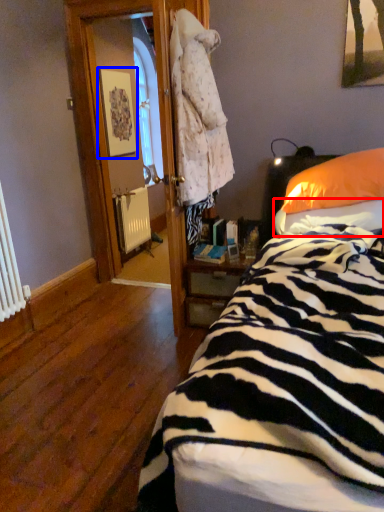
Question: Which object appears closest to the camera in this image, sheet (highlighted by a red box) or picture frame (highlighted by a blue box)?

Choices:
 (A) sheet
 (B) picture frame

Answer: (A)